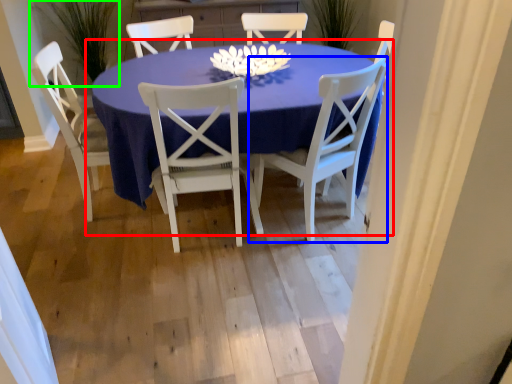
Question: Based on their relative distances, which object is nearer to kitchen & dining room table (highlighted by a red box)? Choose from chair (highlighted by a blue box) and plant (highlighted by a green box).

Choices:
 (A) chair
 (B) plant

Answer: (A)